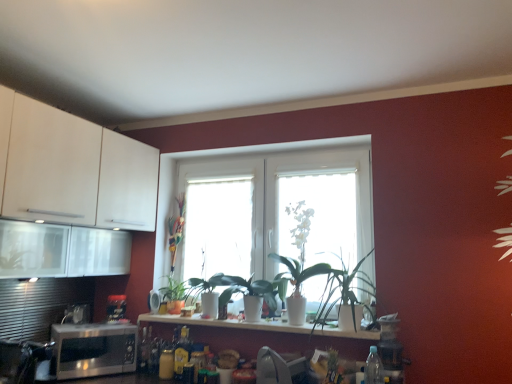
Find the location of `vacant area situated below green glossy plant at center, which appears as the 3th plant when viewed from the left (from a real-world perspective)`. vacant area situated below green glossy plant at center, which appears as the 3th plant when viewed from the left (from a real-world perspective) is located at coordinates (199, 318).